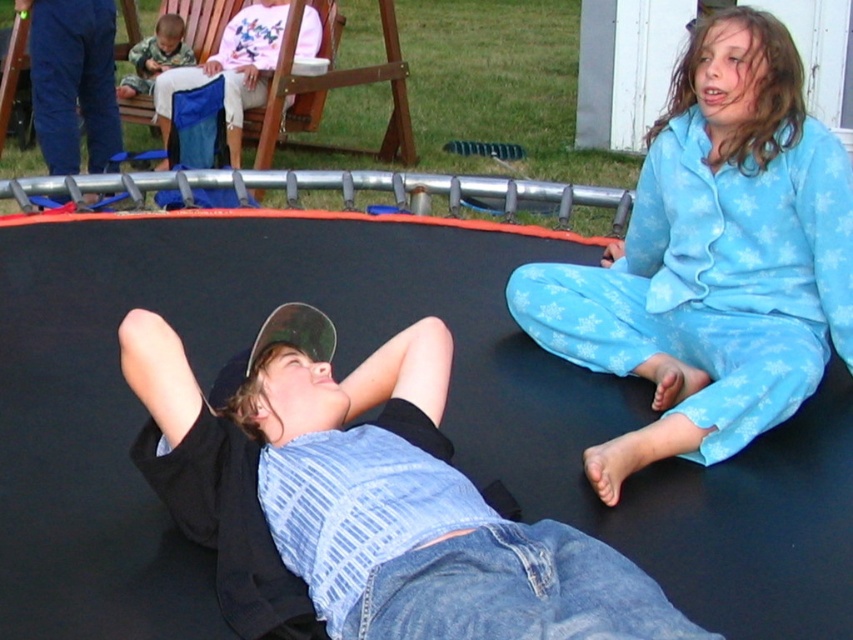
You are standing 5 feet away from the trampoline and want to toss a small ball to the denim shirt at center. Is the distance within your throwing range?

The denim shirt at center is 4.58 feet away from the viewer, so yes, the distance is within the throwing range since it is less than 5 feet.

You are standing in front of the trampoline where two children are playing. You notice two specific points marked on the trampoline surface. The first point is at coordinates point (566, 349) and the second is at point (163, 45). If you want to throw a ball to the point that is closer to you, which point should you aim for?

You should aim for point (566, 349) because it is closer to the viewer than point (163, 45).

You are a photographer trying to capture a candid shot of both children on the trampoline. Since the denim shirt at center and the camouflage fabric shirt at upper left are in different positions, which child should you focus on first to ensure they are in the frame before the other?

The denim shirt at center is larger in size than the camouflage fabric shirt at upper left, so focusing on the denim shirt at center first will ensure it stays in frame before the smaller camouflage fabric shirt at upper left.